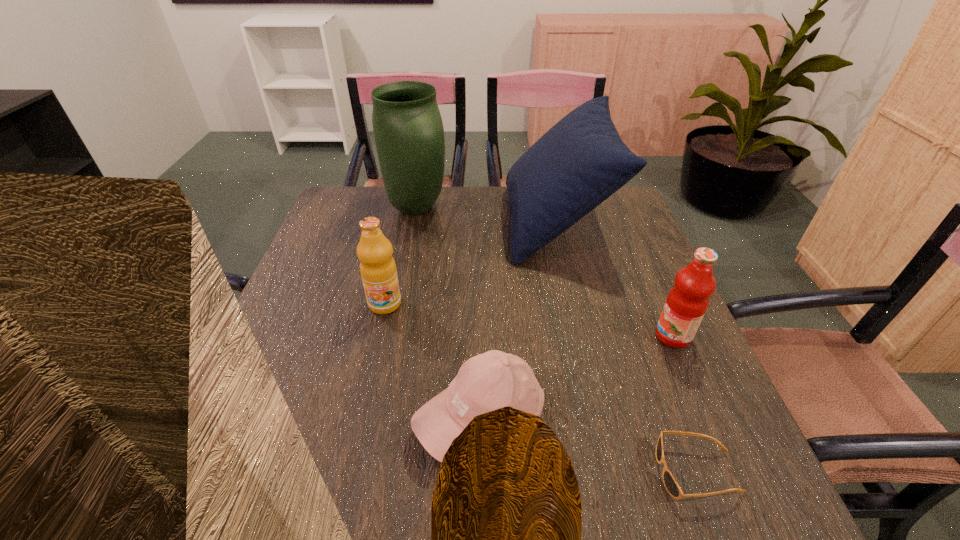
Image resolution: width=960 pixels, height=540 pixels. In order to click on cushion that is at the far edge in this screenshot , I will do `click(581, 161)`.

The image size is (960, 540). I want to click on baseball cap that is positioned at the near edge, so click(492, 380).

Identify the location of sunglasses positioned at the near edge. (672, 487).

You are a GUI agent. You are given a task and a screenshot of the screen. Output one action in this format:
    pyautogui.click(x=<x>, y=<y>)
    Task: Click on the object that is at the left edge
    This screenshot has height=540, width=960.
    Given the screenshot: What is the action you would take?
    pyautogui.click(x=408, y=129)

The image size is (960, 540). Identify the location of cushion located in the right edge section of the desktop. (581, 161).

Where is `fruit juice positioned at the right edge`? The image size is (960, 540). fruit juice positioned at the right edge is located at coordinates (685, 306).

The image size is (960, 540). What are the coordinates of `sunglasses at the right edge` in the screenshot? It's located at (672, 487).

What are the coordinates of `object positioned at the far left corner` in the screenshot? It's located at (408, 129).

This screenshot has height=540, width=960. Find the location of `object positioned at the far right corner`. object positioned at the far right corner is located at coordinates (581, 161).

This screenshot has width=960, height=540. Identify the location of object present at the near right corner. (672, 487).